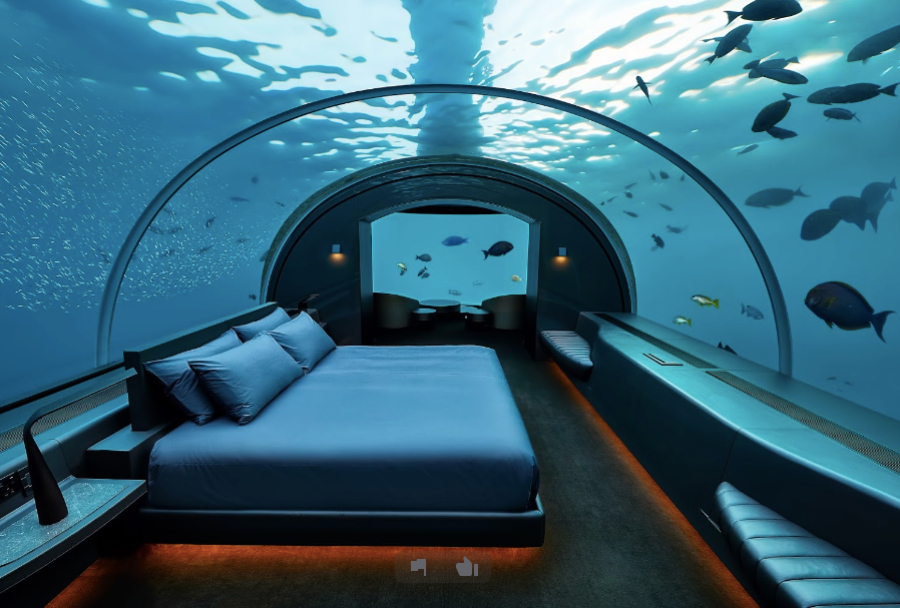
Where is `pillow`? Image resolution: width=900 pixels, height=608 pixels. pillow is located at coordinates (174, 379), (258, 379), (262, 325), (302, 337).